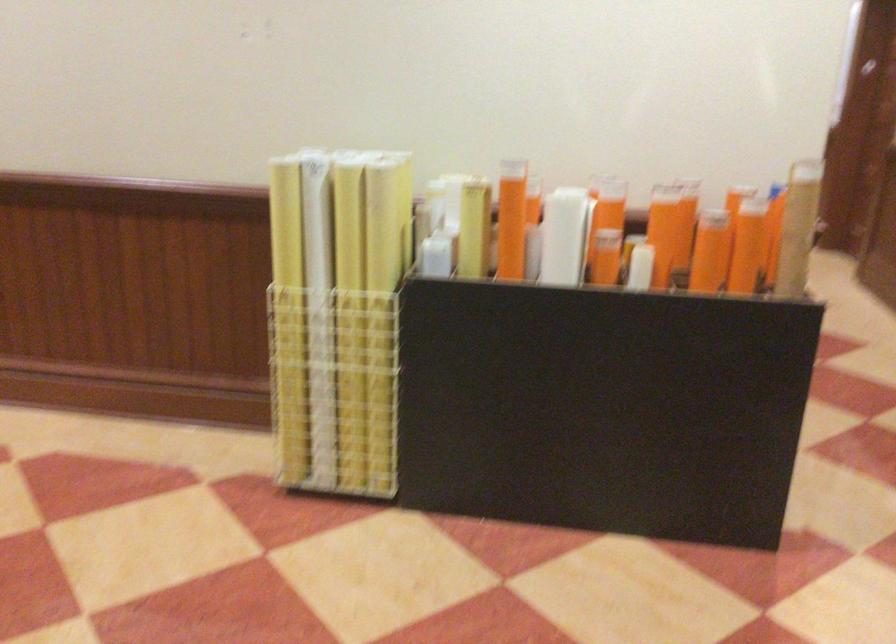
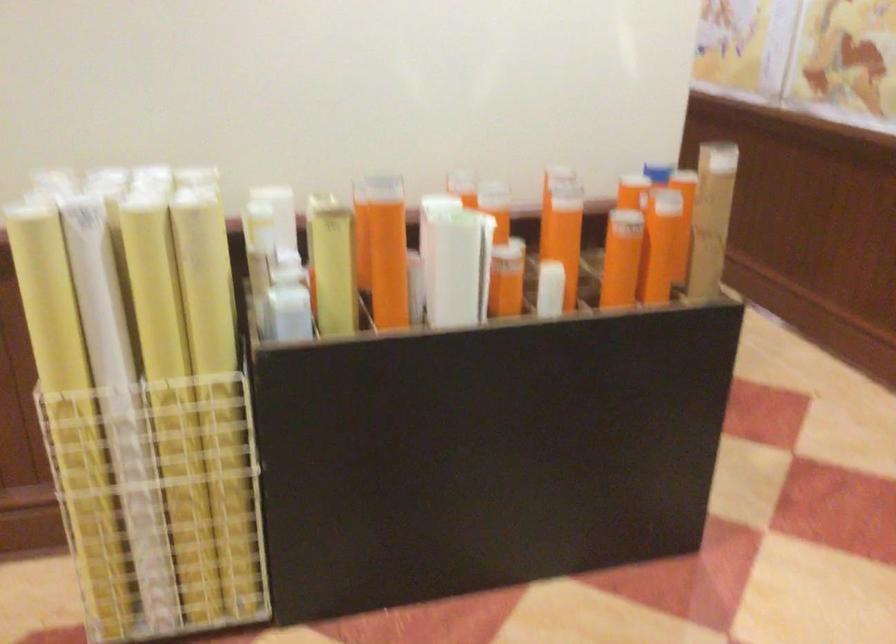
The images are taken continuously from a first-person perspective. In which direction are you moving?

The cameraman walked toward left, forward.